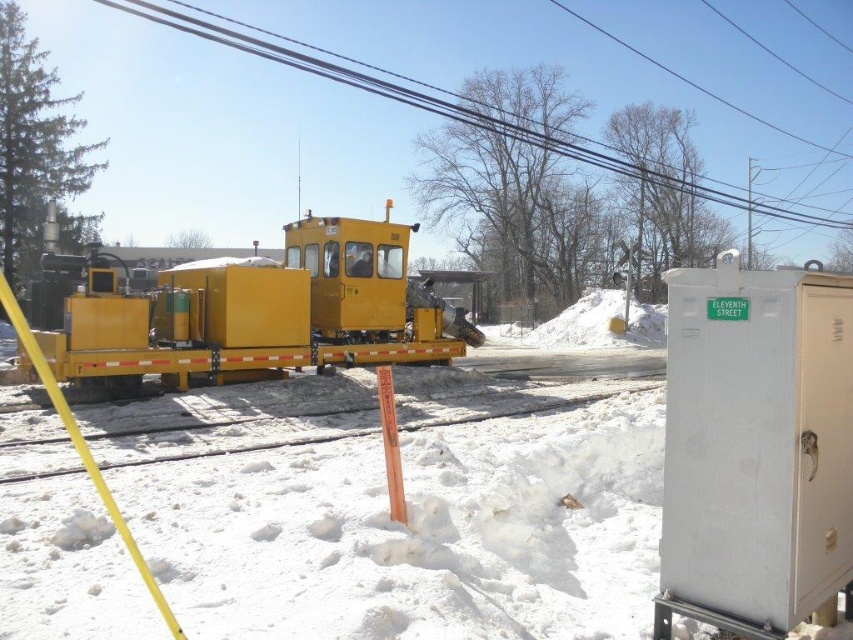
Question: Does white metallic cabinet at right have a greater width compared to yellow matte train at center?

Choices:
 (A) no
 (B) yes

Answer: (A)

Question: Which point is farther to the camera?

Choices:
 (A) white metallic cabinet at right
 (B) yellow matte train at center
 (C) smooth yellow cable at upper center

Answer: (C)

Question: Estimate the real-world distances between objects in this image. Which object is closer to the yellow matte train at center?

Choices:
 (A) smooth yellow cable at upper center
 (B) white metallic cabinet at right

Answer: (B)

Question: Is the position of white metallic cabinet at right less distant than that of yellow matte train at center?

Choices:
 (A) no
 (B) yes

Answer: (B)

Question: Can you confirm if white metallic cabinet at right is positioned to the right of smooth yellow cable at upper center?

Choices:
 (A) no
 (B) yes

Answer: (B)

Question: Which of the following is the closest to the observer?

Choices:
 (A) (113, 316)
 (B) (648, 176)
 (C) (695, 445)

Answer: (C)